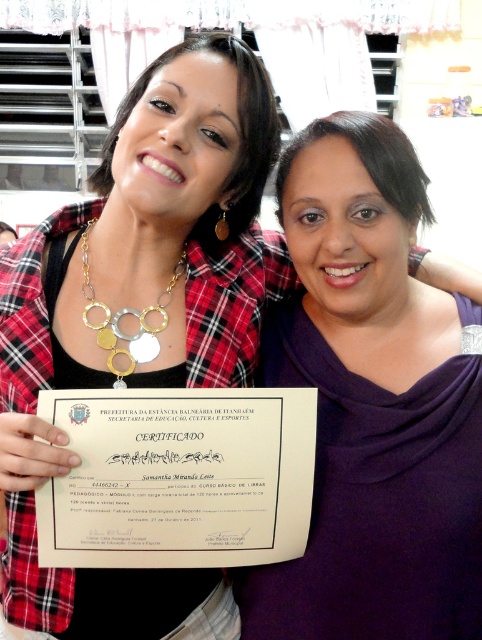
Can you confirm if purple matte sweater at center is shorter than gold metallic necklace at left?

In fact, purple matte sweater at center may be taller than gold metallic necklace at left.

Does purple matte sweater at center have a lesser width compared to gold metallic necklace at left?

Incorrect, purple matte sweater at center's width is not less than gold metallic necklace at left's.

At what (x,y) coordinates should I click in order to perform the action: click on purple matte sweater at center. Please return your answer as a coordinate pair (x, y). Looking at the image, I should click on (372, 404).

I want to click on purple matte sweater at center, so click(x=372, y=404).

Between purple matte sweater at center and white paper certificate at center, which one is positioned lower?

white paper certificate at center is lower down.

Between point (466, 516) and point (64, 413), which one is positioned in front?

Point (64, 413)

What are the coordinates of `purple matte sweater at center` in the screenshot? It's located at (372, 404).

Between white paper certificate at center and gold metallic necklace at left, which one appears on the left side from the viewer's perspective?

From the viewer's perspective, gold metallic necklace at left appears more on the left side.

Is white paper certificate at center above gold metallic necklace at left?

No.

Between point (114, 429) and point (112, 328), which one is positioned in front?

Point (114, 429) is more forward.

Find the location of `white paper certificate at center`. white paper certificate at center is located at coordinates (178, 477).